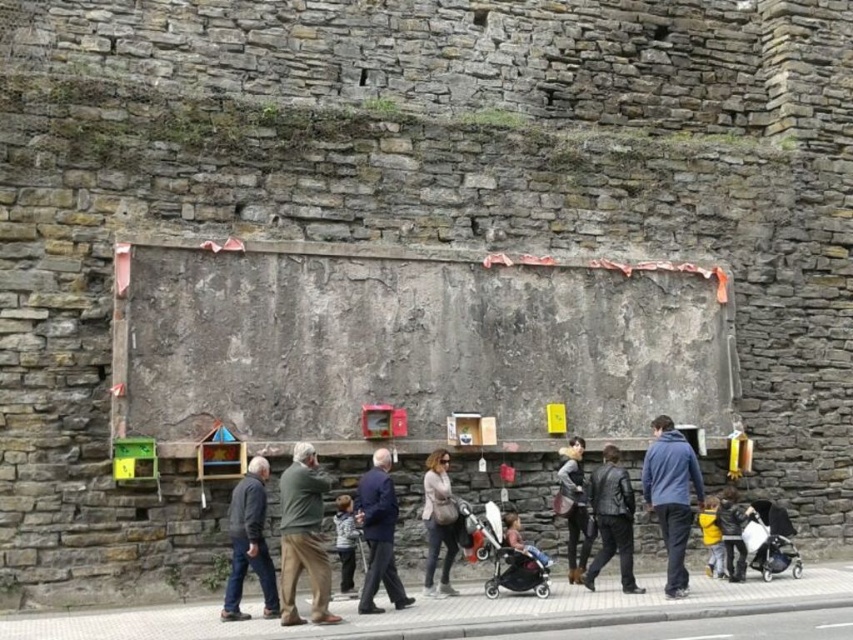
Question: Among these points, which one is nearest to the camera?

Choices:
 (A) (724, 541)
 (B) (445, 557)
 (C) (708, 576)

Answer: (B)

Question: Which is nearer to the matte gray concrete billboard at center?

Choices:
 (A) matte black stroller at center
 (B) yellow matte jacket at lower right
 (C) green wool sweater at center

Answer: (A)

Question: Does matte black stroller at center appear under silver metallic stroller at lower right?

Choices:
 (A) yes
 (B) no

Answer: (B)

Question: Is matte black stroller at center thinner than dark gray leather jacket at center?

Choices:
 (A) yes
 (B) no

Answer: (B)

Question: In this image, where is white concrete pavement at lower center located relative to light brown leather stroller at center?

Choices:
 (A) below
 (B) above

Answer: (A)

Question: Which point is farther from the camera taking this photo?

Choices:
 (A) (492, 557)
 (B) (708, 504)

Answer: (B)